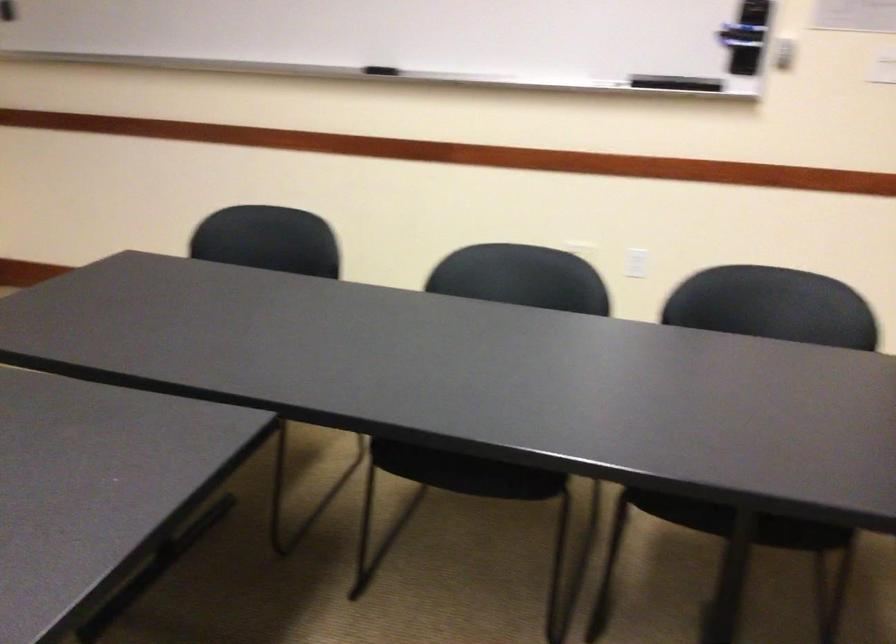
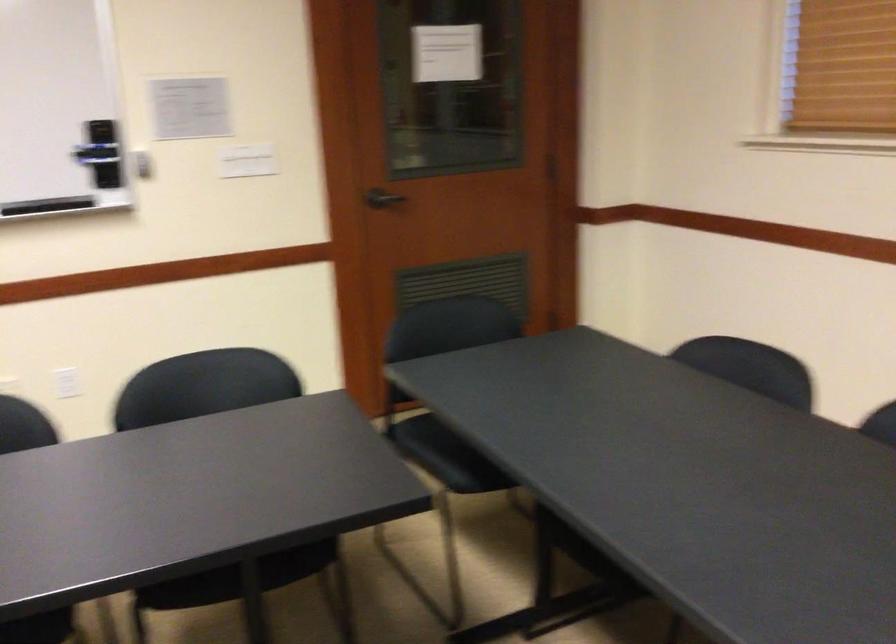
Question: I am providing you with two images of the same scene from different viewpoints. Please identify which objects are invisible in image2.

Choices:
 (A) black whiteboard eraser
 (B) black door handle
 (C) chair sitting surface
 (D) none of these

Answer: (D)